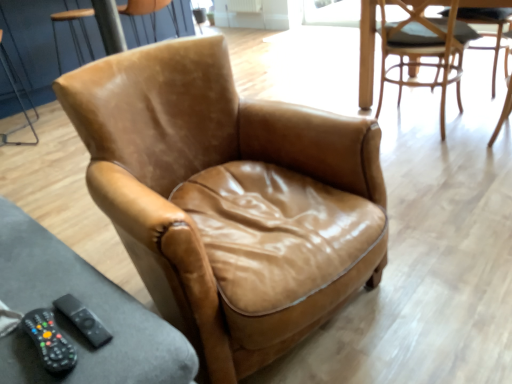
You are a GUI agent. You are given a task and a screenshot of the screen. Output one action in this format:
    pyautogui.click(x=<x>, y=<y>)
    Task: Click on the vacant area that lies to the right of leather armchair at center, which is the first chair from front to back
    
    Given the screenshot: What is the action you would take?
    pyautogui.click(x=440, y=244)